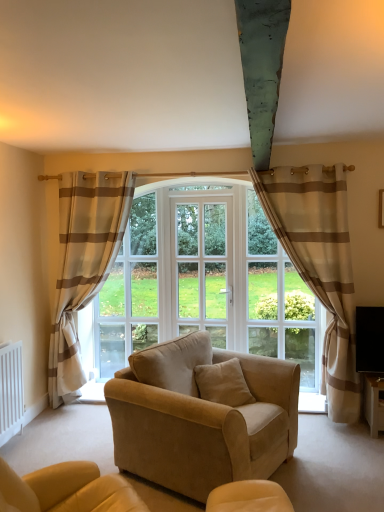
Question: Is white plastic radiator at lower left situated inside suede beige couch at center or outside?

Choices:
 (A) outside
 (B) inside

Answer: (A)

Question: Considering the positions of white plastic radiator at lower left and suede beige couch at center in the image, is white plastic radiator at lower left bigger or smaller than suede beige couch at center?

Choices:
 (A) small
 (B) big

Answer: (A)

Question: Which of these objects is positioned farthest from the white glass screen door at center?

Choices:
 (A) white plastic radiator at lower left
 (B) clear glass window at center
 (C) beige striped curtain at right, the 1th curtain from the right
 (D) beige striped curtain at left, the 1th curtain when ordered from left to right
 (E) suede beige couch at center

Answer: (A)

Question: Considering the real-world distances, which object is farthest from the suede beige couch at center?

Choices:
 (A) white plastic radiator at lower left
 (B) beige striped curtain at right, the 1th curtain from the right
 (C) white glass screen door at center
 (D) clear glass window at center
 (E) beige striped curtain at left, acting as the second curtain starting from the right

Answer: (D)